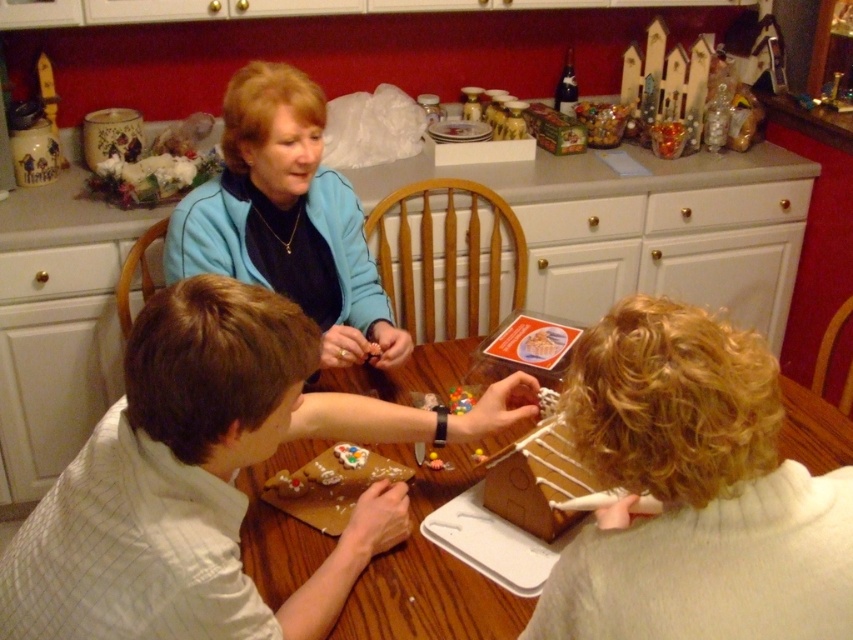
Question: Is white striped shirt at center bigger than blue fleece jacket at upper center?

Choices:
 (A) yes
 (B) no

Answer: (A)

Question: Which object is closer to the camera taking this photo?

Choices:
 (A) wooden table at center
 (B) blue fleece jacket at upper center

Answer: (A)

Question: In this image, where is blue fleece jacket at upper center located relative to wooden table at center?

Choices:
 (A) right
 (B) left

Answer: (B)

Question: Is white striped shirt at center smaller than blue fleece jacket at upper center?

Choices:
 (A) yes
 (B) no

Answer: (B)

Question: Which point is farther to the camera?

Choices:
 (A) 314,628
 (B) 244,170

Answer: (B)

Question: Which object is the farthest from the wooden table at center?

Choices:
 (A) blue fleece jacket at upper center
 (B) white striped shirt at center

Answer: (A)